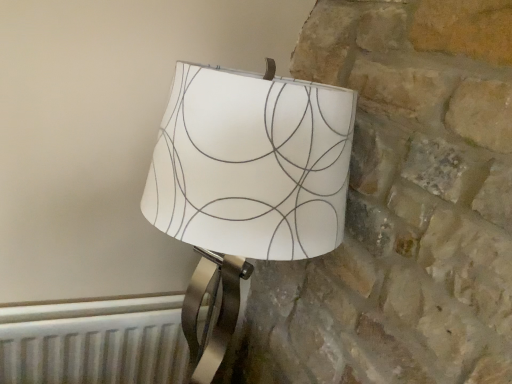
What are the coordinates of `white metallic radiator at lower left` in the screenshot? It's located at (94, 342).

This screenshot has height=384, width=512. Describe the element at coordinates (94, 342) in the screenshot. I see `white metallic radiator at lower left` at that location.

Measure the distance between white metallic radiator at lower left and camera.

They are 3.43 feet apart.

Describe the element at coordinates (247, 182) in the screenshot. I see `white paper lampshade at center` at that location.

Locate an element on the screen. Image resolution: width=512 pixels, height=384 pixels. white paper lampshade at center is located at coordinates (247, 182).

Locate an element on the screen. Image resolution: width=512 pixels, height=384 pixels. white metallic radiator at lower left is located at coordinates (94, 342).

Based on the photo, can you confirm if white metallic radiator at lower left is positioned to the right of white paper lampshade at center?

No.

Considering their positions, is white metallic radiator at lower left located in front of or behind white paper lampshade at center?

In the image, white metallic radiator at lower left appears behind white paper lampshade at center.

Is point (99, 338) behind point (184, 162)?

Yes, point (99, 338) is farther from viewer.

From the image's perspective, is white metallic radiator at lower left over white paper lampshade at center?

Incorrect, from the image's perspective, white metallic radiator at lower left is lower than white paper lampshade at center.

From a real-world perspective, which object stands above the other?

white paper lampshade at center is physically above.

Which of these two, white metallic radiator at lower left or white paper lampshade at center, is wider?

white paper lampshade at center is wider.

From their relative heights in the image, would you say white metallic radiator at lower left is taller or shorter than white paper lampshade at center?

white metallic radiator at lower left is shorter than white paper lampshade at center.

Does white metallic radiator at lower left have a smaller size compared to white paper lampshade at center?

Indeed, white metallic radiator at lower left has a smaller size compared to white paper lampshade at center.

Is white metallic radiator at lower left positioned beyond the bounds of white paper lampshade at center?

white metallic radiator at lower left lies outside white paper lampshade at center's area.

Is the surface of white metallic radiator at lower left in direct contact with white paper lampshade at center?

No, white metallic radiator at lower left is not making contact with white paper lampshade at center.

Is white metallic radiator at lower left oriented towards white paper lampshade at center?

Yes, white metallic radiator at lower left is turned towards white paper lampshade at center.

There is a white metallic radiator at lower left. Where is `lamp above it (from a real-world perspective)`? This screenshot has width=512, height=384. lamp above it (from a real-world perspective) is located at coordinates (247, 182).

Is white paper lampshade at center to the left of white metallic radiator at lower left from the viewer's perspective?

Incorrect, white paper lampshade at center is not on the left side of white metallic radiator at lower left.

Looking at this image, relative to white metallic radiator at lower left, is white paper lampshade at center in front or behind?

white paper lampshade at center is in front of white metallic radiator at lower left.

Does point (191, 313) appear closer or farther from the camera than point (132, 381)?

Point (191, 313) is positioned closer to the camera compared to point (132, 381).

From the image's perspective, which one is positioned higher, white paper lampshade at center or white metallic radiator at lower left?

white paper lampshade at center appears higher in the image.

From a real-world perspective, is white paper lampshade at center above or below white metallic radiator at lower left?

In terms of real-world spatial position, white paper lampshade at center is above white metallic radiator at lower left.

Looking at this image, between white paper lampshade at center and white metallic radiator at lower left, which one has smaller width?

white metallic radiator at lower left is thinner.

Between white paper lampshade at center and white metallic radiator at lower left, which one has less height?

white metallic radiator at lower left is shorter.

Which of these two, white paper lampshade at center or white metallic radiator at lower left, is bigger?

Bigger between the two is white paper lampshade at center.

Does white paper lampshade at center contain white metallic radiator at lower left?

No.

Would you consider white paper lampshade at center to be distant from white metallic radiator at lower left?

Actually, white paper lampshade at center and white metallic radiator at lower left are a little close together.

Is white paper lampshade at center facing towards white metallic radiator at lower left?

No, white paper lampshade at center does not turn towards white metallic radiator at lower left.

Can you tell me how much white paper lampshade at center and white metallic radiator at lower left differ in facing direction?

There is a 0.0049-degree angle between the facing directions of white paper lampshade at center and white metallic radiator at lower left.

How distant is white paper lampshade at center from white metallic radiator at lower left?

white paper lampshade at center and white metallic radiator at lower left are 24.41 inches apart.

I want to click on lamp above the white metallic radiator at lower left (from the image's perspective), so click(x=247, y=182).

Where is `radiator directly beneath the white paper lampshade at center (from a real-world perspective)`? The height and width of the screenshot is (384, 512). radiator directly beneath the white paper lampshade at center (from a real-world perspective) is located at coordinates (94, 342).

Find the location of a particular element. lamp on the right side of white metallic radiator at lower left is located at coordinates pyautogui.click(x=247, y=182).